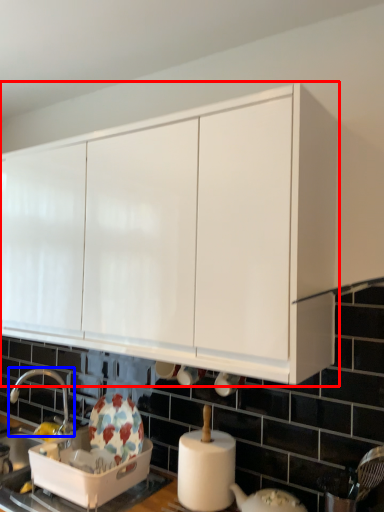
Question: Which of the following is the closest to the observer, cabinetry (highlighted by a red box) or tap (highlighted by a blue box)?

Choices:
 (A) cabinetry
 (B) tap

Answer: (A)